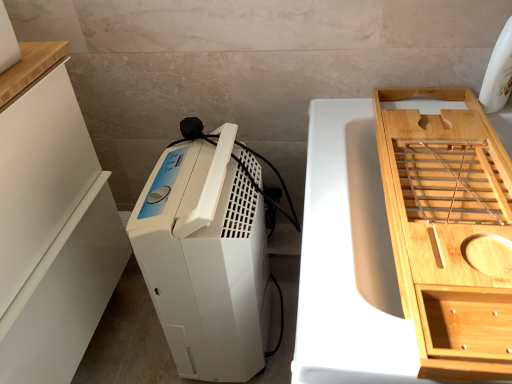
Locate an element on the screen. blank space situated above light wood/texture bamboo tray at right, which ranks as the 2th cabinetry in left-to-right order (from a real-world perspective) is located at coordinates (446, 177).